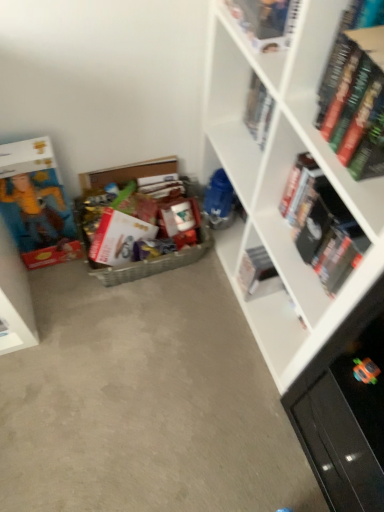
This screenshot has width=384, height=512. Find the location of `vacant space positioned to the left of white matte book at center, which is the third book in right-to-left order`. vacant space positioned to the left of white matte book at center, which is the third book in right-to-left order is located at coordinates (208, 297).